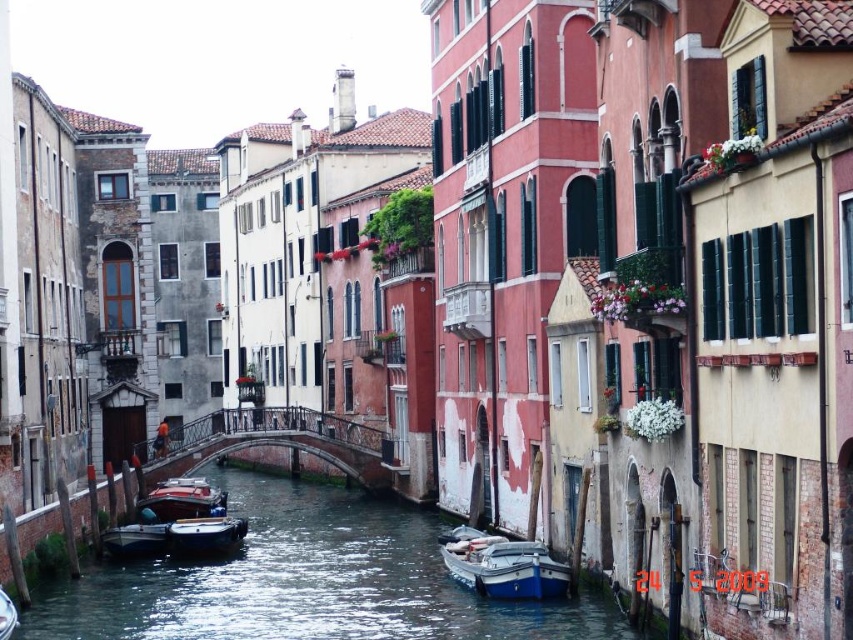
Question: Which point appears closest to the camera in this image?

Choices:
 (A) (543, 557)
 (B) (109, 621)

Answer: (A)

Question: Which point appears closest to the camera in this image?

Choices:
 (A) (288, 438)
 (B) (431, 563)
 (C) (138, 524)
 (D) (466, 579)

Answer: (D)

Question: Which point is farther to the camera?

Choices:
 (A) 149,525
 (B) 236,445

Answer: (B)

Question: Can you confirm if metallic bridge at center is smaller than matte black boat at center?

Choices:
 (A) no
 (B) yes

Answer: (A)

Question: Can you confirm if clear water at center is positioned to the right of shiny red boat at center?

Choices:
 (A) no
 (B) yes

Answer: (B)

Question: Can you confirm if clear water at center is thinner than matte black boat at center?

Choices:
 (A) yes
 (B) no

Answer: (B)